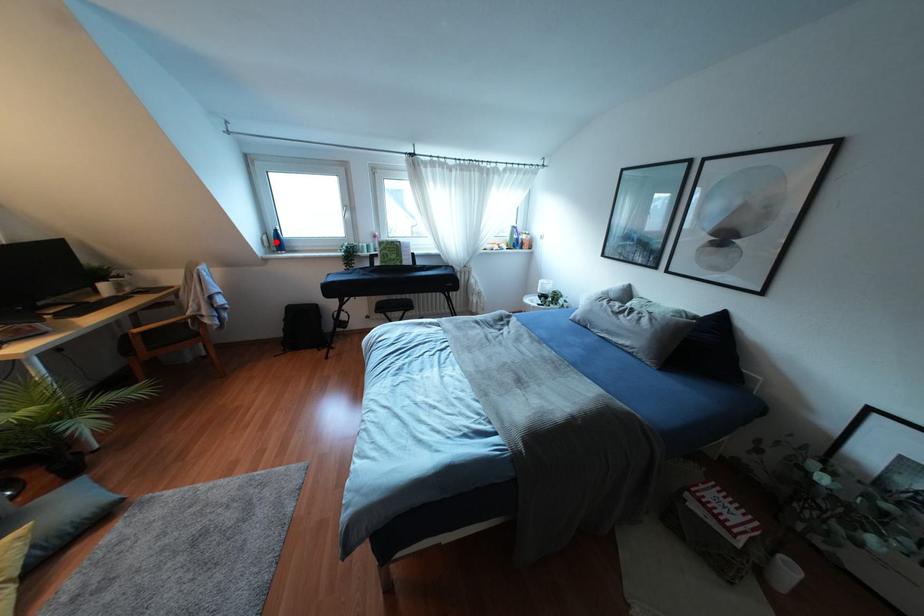
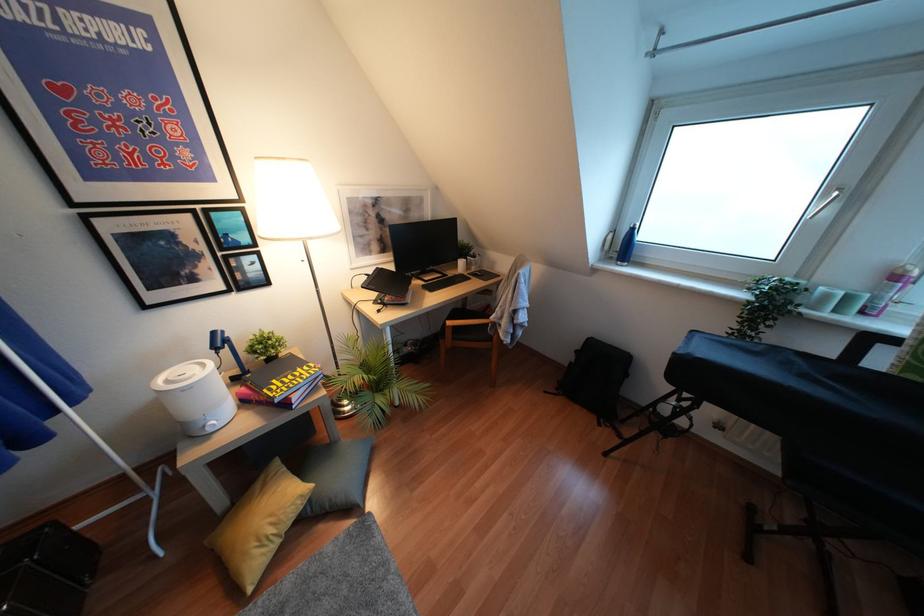
Where in the second image is the point corresponding to the highlighted location from the first image?

(623, 246)